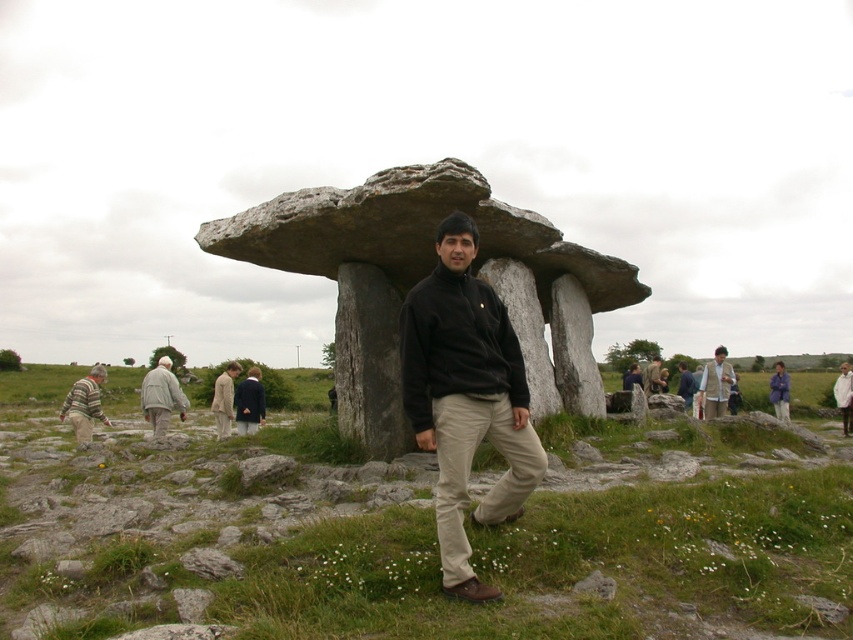
Question: Which of these objects is positioned closest to the green grass at center?

Choices:
 (A) khaki pants at center
 (B) rough stone structure at center
 (C) blue fabric jacket at lower right

Answer: (B)

Question: Can you confirm if rough stone structure at center is thinner than dark brown leather jacket at center?

Choices:
 (A) no
 (B) yes

Answer: (A)

Question: Among these objects, which one is nearest to the camera?

Choices:
 (A) dark blue jacket at center
 (B) light gray fabric jacket at left

Answer: (B)

Question: Does green grass at center have a smaller size compared to white matte jacket at center?

Choices:
 (A) yes
 (B) no

Answer: (B)

Question: Which point is closer to the camera?

Choices:
 (A) dark brown leather jacket at center
 (B) light gray fabric jacket at left
 (C) rough stone structure at center

Answer: (C)

Question: Is the position of black fleece at center less distant than that of blue fabric jacket at lower right?

Choices:
 (A) yes
 (B) no

Answer: (A)